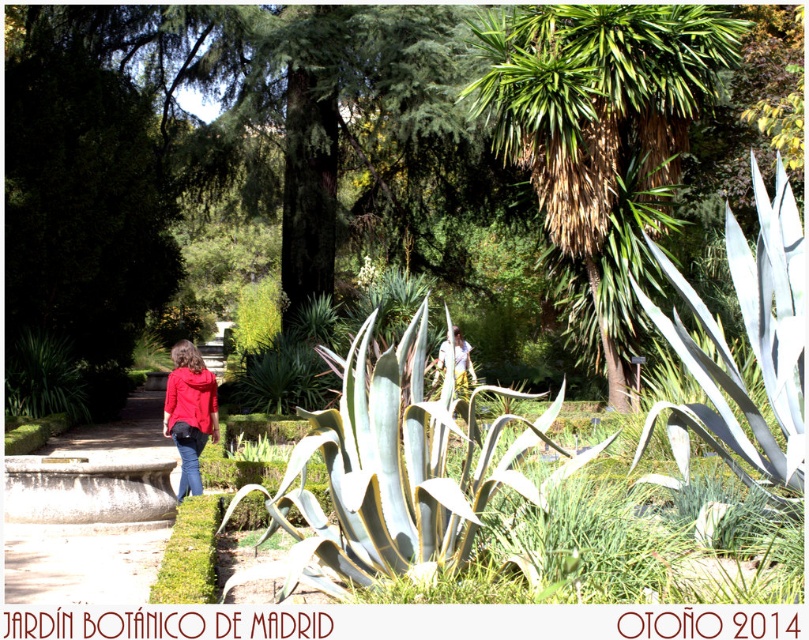
Is point (202, 445) closer to camera compared to point (189, 371)?

No, (202, 445) is further to viewer.

Is matte red hoodie at center positioned behind matte red jacket at center?

No.

Image resolution: width=809 pixels, height=640 pixels. Describe the element at coordinates (189, 412) in the screenshot. I see `matte red hoodie at center` at that location.

Where is `matte red hoodie at center`? The width and height of the screenshot is (809, 640). matte red hoodie at center is located at coordinates (189, 412).

Is denim jeans at lower left thinner than light brown hair at center?

In fact, denim jeans at lower left might be wider than light brown hair at center.

Is point (206, 435) in front of point (454, 349)?

That is True.

Find the location of a particular element. denim jeans at lower left is located at coordinates (189, 460).

Which is more to the left, matte red jacket at center or denim jeans at lower left?

matte red jacket at center

Does matte red jacket at center appear under denim jeans at lower left?

No.

Between point (215, 406) and point (187, 436), which one is positioned in front?

Point (187, 436) is more forward.

I want to click on matte red jacket at center, so click(189, 401).